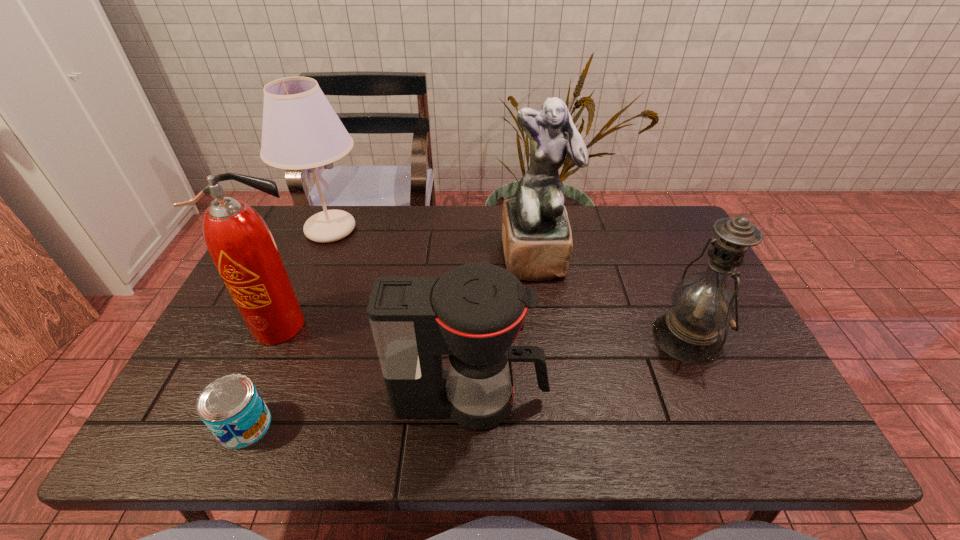
Locate an element on the screen. object present at the far left corner is located at coordinates (300, 130).

The image size is (960, 540). Find the location of `object present at the near left corner`. object present at the near left corner is located at coordinates (231, 407).

This screenshot has height=540, width=960. In the image, there is a desktop. What are the coordinates of `vacant space at the far edge` in the screenshot? It's located at (428, 210).

Find the location of `blank space at the near edge of the desktop`. blank space at the near edge of the desktop is located at coordinates [x=437, y=427].

The height and width of the screenshot is (540, 960). I want to click on vacant position at the left edge of the desktop, so click(307, 252).

At what (x,y) coordinates should I click in order to perform the action: click on free region at the right edge of the desktop. Please return your answer as a coordinate pair (x, y). Looking at the image, I should click on (779, 390).

This screenshot has height=540, width=960. What are the coordinates of `free space at the far right corner` in the screenshot? It's located at (640, 210).

This screenshot has width=960, height=540. Find the location of `vacant point located between the sculpture and the lampshade`. vacant point located between the sculpture and the lampshade is located at coordinates (433, 242).

Locate an element on the screen. This screenshot has height=540, width=960. unoccupied position between the sculpture and the lampshade is located at coordinates (433, 242).

The image size is (960, 540). What are the coordinates of `free space between the fire extinguisher and the lampshade` in the screenshot? It's located at (306, 277).